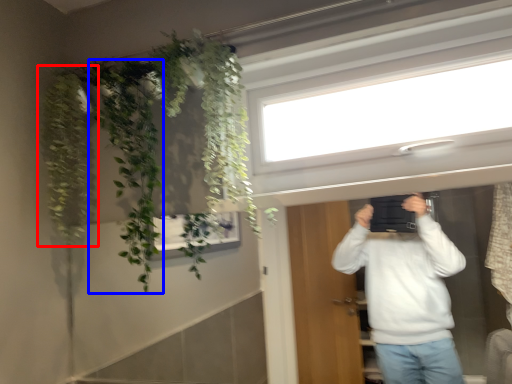
Question: Which point is further to the camera, plant (highlighted by a red box) or plant (highlighted by a blue box)?

Choices:
 (A) plant
 (B) plant

Answer: (A)